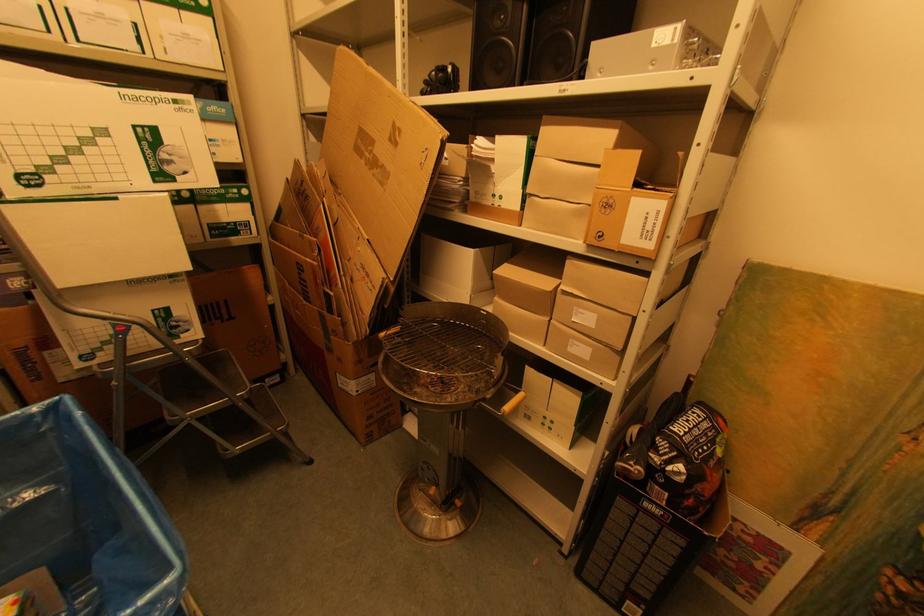
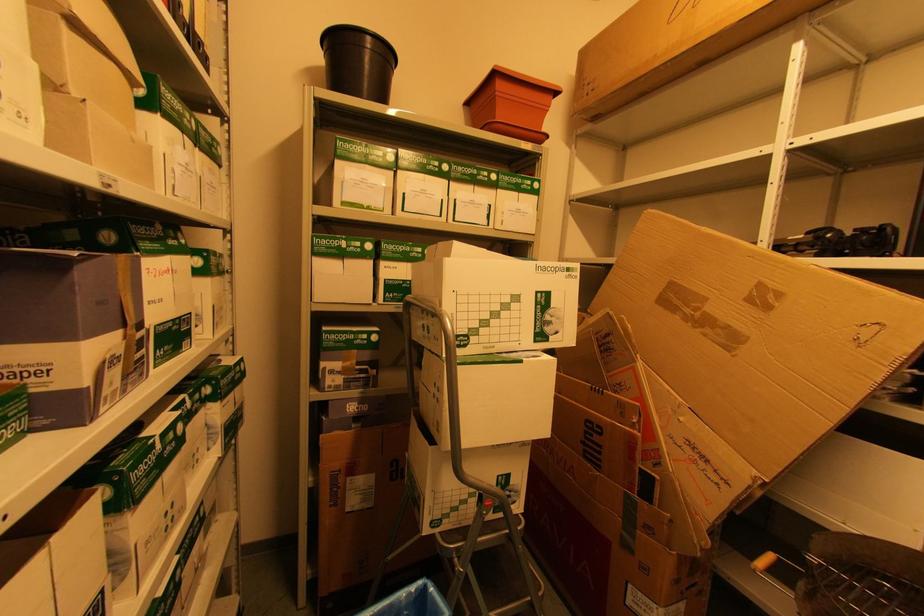
Question: In a continuous first-person perspective shot, in which direction is the camera moving?

Choices:
 (A) Left
 (B) Right
 (C) Forward
 (D) Backward

Answer: (A)